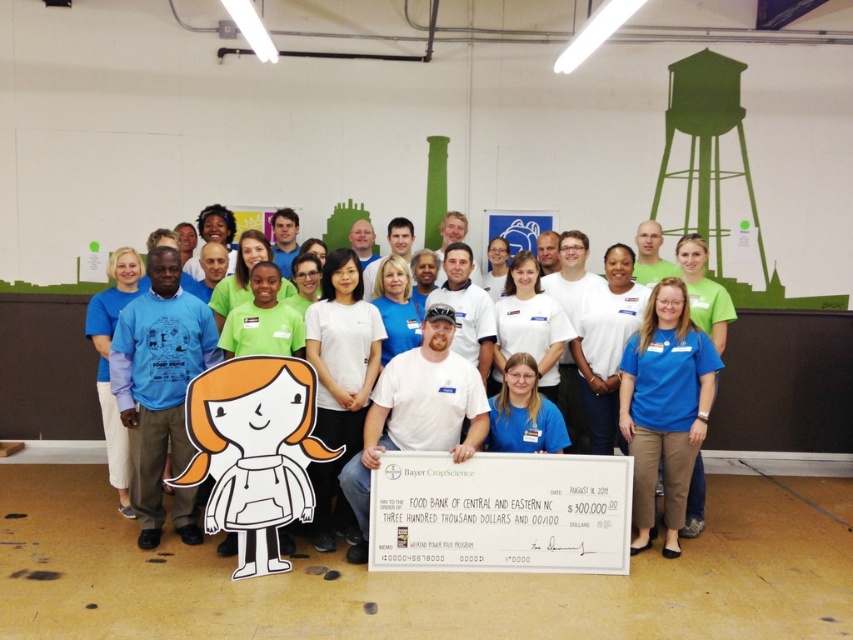
Is blue fabric shirt at center shorter than white paper cutout at center?

Incorrect, blue fabric shirt at center's height does not fall short of white paper cutout at center's.

Does blue fabric shirt at center have a lesser width compared to white paper cutout at center?

Indeed, blue fabric shirt at center has a lesser width compared to white paper cutout at center.

Is point (625, 369) closer to viewer compared to point (671, 490)?

No, it is behind (671, 490).

Locate an element on the screen. The height and width of the screenshot is (640, 853). blue fabric shirt at center is located at coordinates (664, 408).